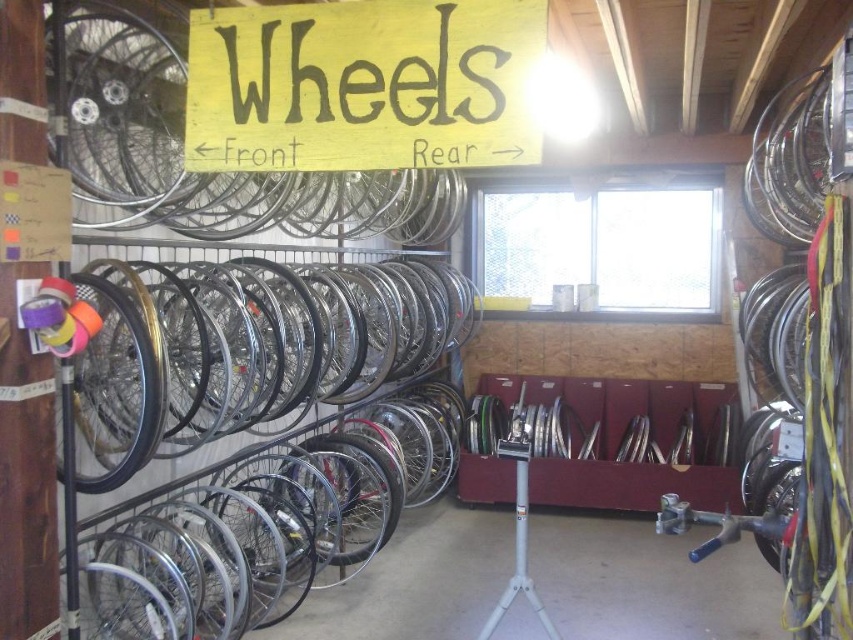
Can you confirm if yellow wood sign at upper center is taller than gold metallic rim at left?

No.

Is point (291, 77) closer to viewer compared to point (113, 483)?

That is True.

Locate an element on the screen. The image size is (853, 640). yellow wood sign at upper center is located at coordinates [x=363, y=84].

Which of these two, silver metallic rim at upper left or gold metallic rim at left, stands shorter?

Standing shorter between the two is silver metallic rim at upper left.

Is silver metallic rim at upper left to the left of gold metallic rim at left from the viewer's perspective?

Incorrect, silver metallic rim at upper left is not on the left side of gold metallic rim at left.

Describe the element at coordinates (212, 173) in the screenshot. The image size is (853, 640). I see `silver metallic rim at upper left` at that location.

This screenshot has height=640, width=853. Identify the location of silver metallic rim at upper left. (212, 173).

Is yellow wood sign at upper center taller than silver metallic rim at upper left?

No, yellow wood sign at upper center is not taller than silver metallic rim at upper left.

Where is `yellow wood sign at upper center`? yellow wood sign at upper center is located at coordinates (x=363, y=84).